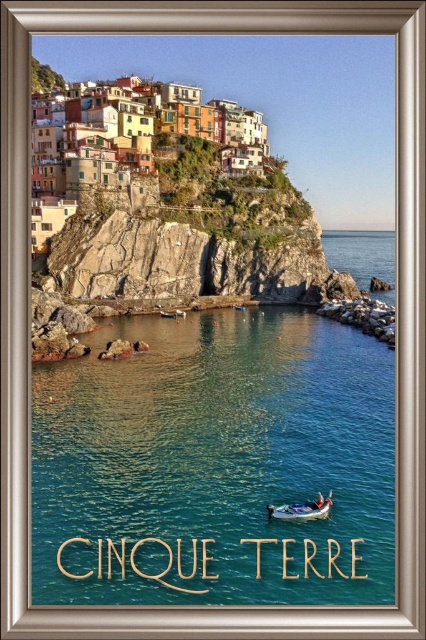
Question: Which point is farther from the camera taking this photo?

Choices:
 (A) [x=345, y=564]
 (B) [x=328, y=500]

Answer: (B)

Question: Does clear blue water at center appear under teal plastic boat at lower center?

Choices:
 (A) yes
 (B) no

Answer: (B)

Question: Among these objects, which one is nearest to the camera?

Choices:
 (A) teal plastic boat at lower center
 (B) clear blue water at center

Answer: (B)

Question: Considering the relative positions of clear blue water at center and teal plastic boat at lower center in the image provided, where is clear blue water at center located with respect to teal plastic boat at lower center?

Choices:
 (A) above
 (B) below

Answer: (A)

Question: Is the position of clear blue water at center more distant than that of teal plastic boat at lower center?

Choices:
 (A) yes
 (B) no

Answer: (B)

Question: Which point is farther to the camera?

Choices:
 (A) clear blue water at center
 (B) teal plastic boat at lower center

Answer: (B)